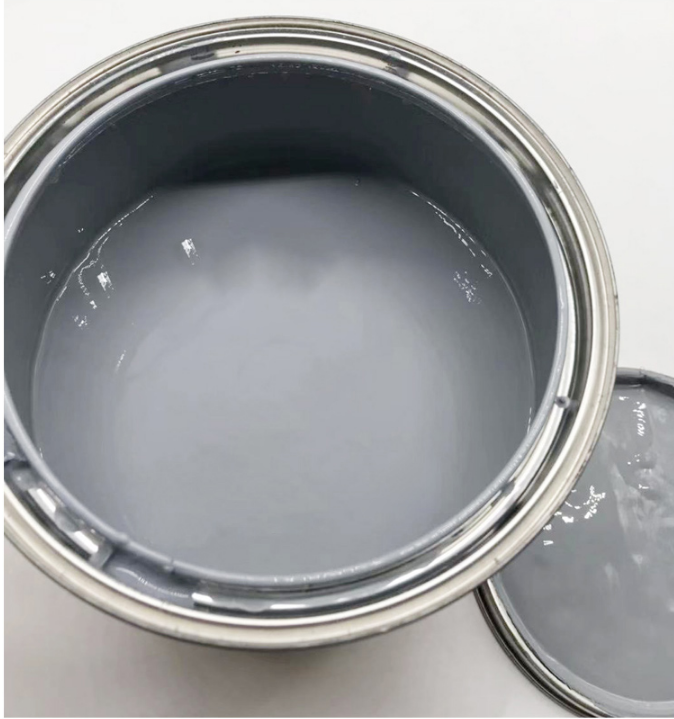
Where is `gray paint`? The width and height of the screenshot is (674, 719). gray paint is located at coordinates (259, 370).